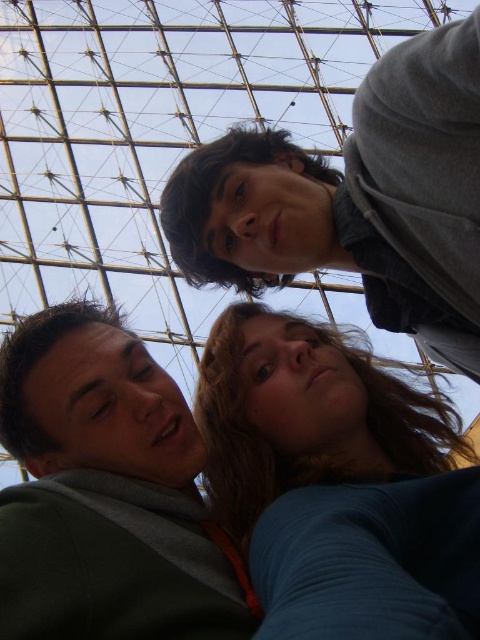
Question: Based on their relative distances, which object is nearer to the blue fabric at center?

Choices:
 (A) dark gray hoodie at upper center
 (B) green matte jacket at lower left

Answer: (B)

Question: Which is farther from the dark gray hoodie at upper center?

Choices:
 (A) blue fabric at center
 (B) green matte jacket at lower left

Answer: (B)

Question: Does dark gray hoodie at upper center appear on the left side of green matte jacket at lower left?

Choices:
 (A) yes
 (B) no

Answer: (B)

Question: Does blue fabric at center have a smaller size compared to green matte jacket at lower left?

Choices:
 (A) yes
 (B) no

Answer: (B)

Question: Which point is closer to the camera?

Choices:
 (A) blue fabric at center
 (B) dark gray hoodie at upper center
 (C) green matte jacket at lower left

Answer: (A)

Question: Does blue fabric at center appear on the right side of dark gray hoodie at upper center?

Choices:
 (A) no
 (B) yes

Answer: (B)